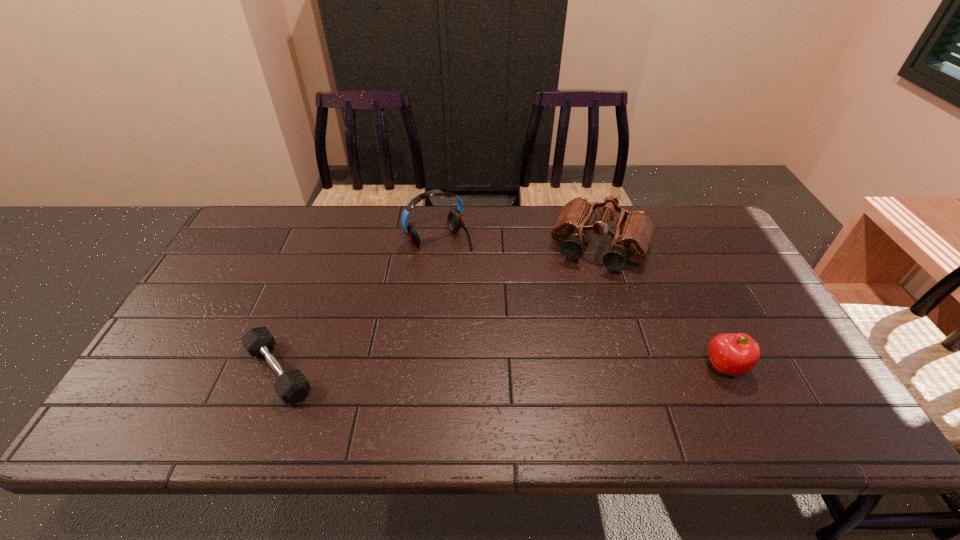
Find the location of a particular element. the leftmost object is located at coordinates (292, 385).

You are a GUI agent. You are given a task and a screenshot of the screen. Output one action in this format:
    pyautogui.click(x=<x>, y=<y>)
    Task: Click on the shortest object
    This screenshot has width=960, height=540.
    Given the screenshot: What is the action you would take?
    pyautogui.click(x=292, y=385)

What are the coordinates of `apple` in the screenshot? It's located at (734, 354).

Locate an element on the screen. Image resolution: width=960 pixels, height=540 pixels. headset is located at coordinates (455, 216).

Identify the location of the second object from left to right. This screenshot has height=540, width=960. (455, 216).

Find the location of a particular element. This screenshot has width=960, height=540. the third shortest object is located at coordinates (633, 233).

This screenshot has height=540, width=960. What are the coordinates of `blank space located on the back of the dumbbell` in the screenshot? It's located at [316, 276].

Locate an element on the screen. free space located on the back of the apple is located at coordinates (679, 273).

Find the location of `free space located with the microphone attached to the side of the headset`. free space located with the microphone attached to the side of the headset is located at coordinates (529, 338).

Find the location of `vacant space located 0.320m with the microphone attached to the side of the headset`. vacant space located 0.320m with the microphone attached to the side of the headset is located at coordinates (512, 318).